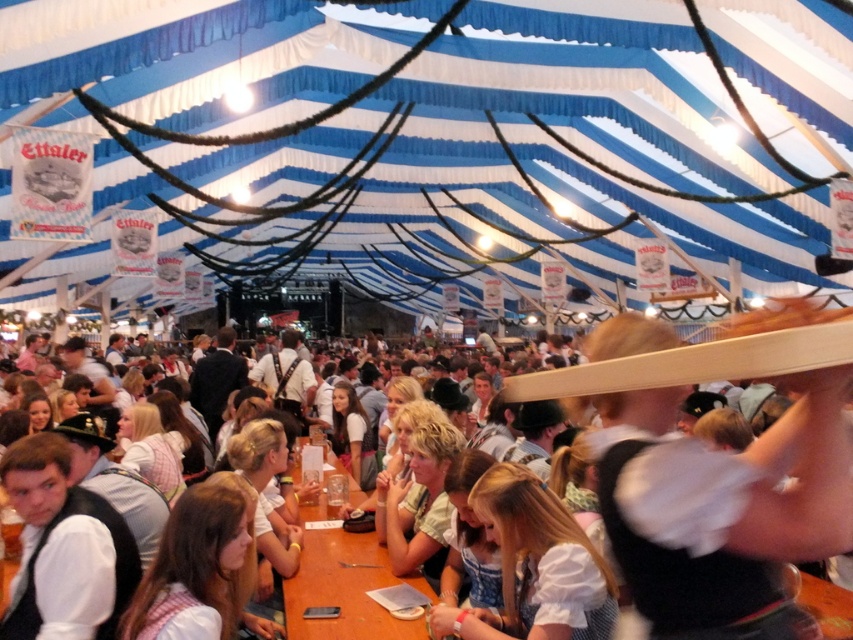
Is white fabric dress at center in front of brown wooden table at center?

Yes, it is.

Is white fabric dress at center below brown wooden table at center?

Actually, white fabric dress at center is above brown wooden table at center.

The height and width of the screenshot is (640, 853). In order to click on white fabric dress at center in this screenshot , I will do `click(738, 481)`.

Is white cotton blouse at lower center further to camera compared to brown wooden table at center?

That is False.

This screenshot has width=853, height=640. I want to click on white cotton blouse at lower center, so click(534, 566).

Is white fabric dress at center wider than white cotton blouse at lower center?

Yes, white fabric dress at center is wider than white cotton blouse at lower center.

Between white fabric dress at center and white cotton blouse at lower center, which one has more height?

Standing taller between the two is white fabric dress at center.

Which is in front, point (639, 506) or point (523, 529)?

Point (639, 506) is more forward.

Image resolution: width=853 pixels, height=640 pixels. Find the location of `white fabric dress at center`. white fabric dress at center is located at coordinates (738, 481).